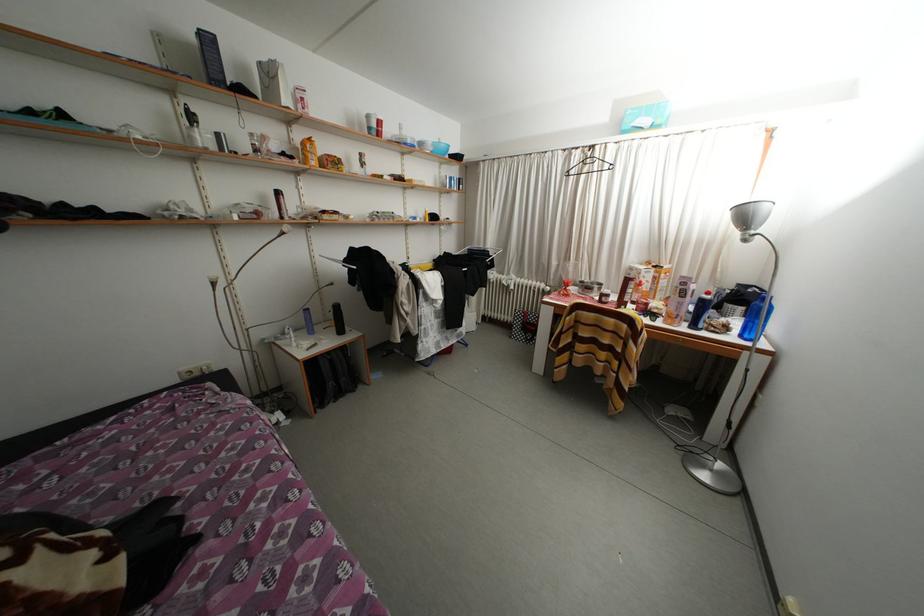
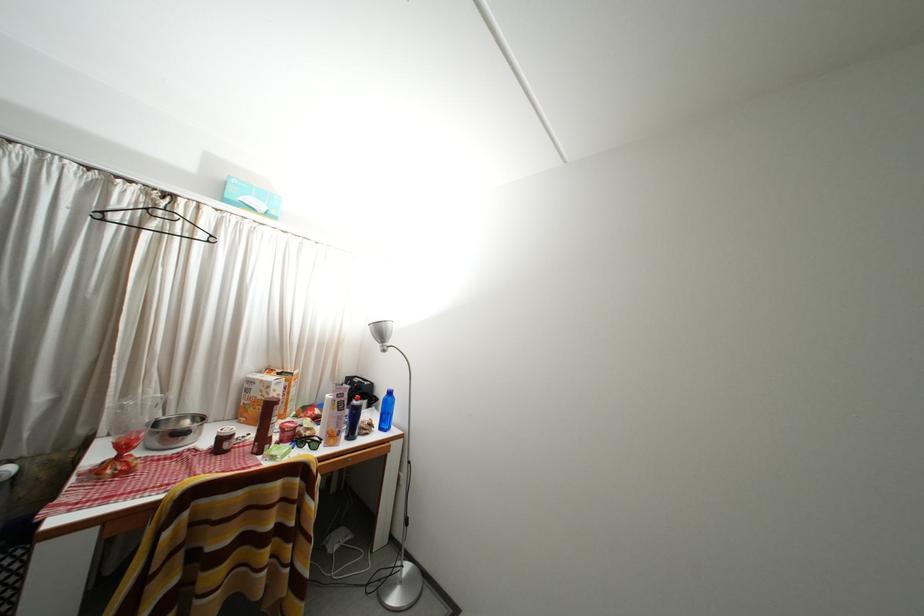
Find the pixel in the second image that matches (601,288) in the first image.

(188, 424)